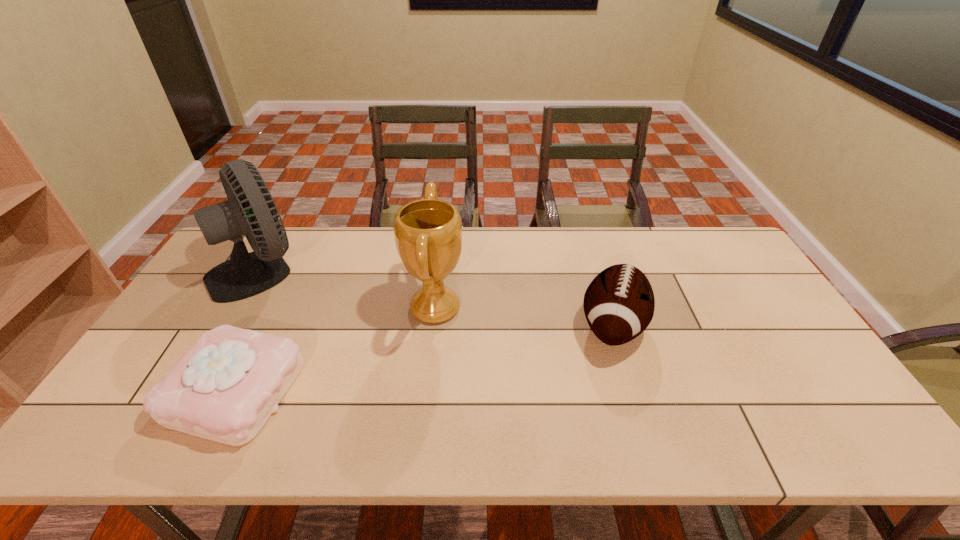
At what (x,y) coordinates should I click in order to perform the action: click on object that is at the near edge. Please return your answer as a coordinate pair (x, y). Looking at the image, I should click on (224, 388).

Image resolution: width=960 pixels, height=540 pixels. I want to click on fan situated at the left edge, so click(250, 210).

Identify the location of cake located at the left edge. Image resolution: width=960 pixels, height=540 pixels. (224, 388).

Identify the location of object that is at the far left corner. (x=250, y=210).

Where is `object that is at the near left corner`? The width and height of the screenshot is (960, 540). object that is at the near left corner is located at coordinates (224, 388).

Where is `vacant space at the far edge of the desktop`? The image size is (960, 540). vacant space at the far edge of the desktop is located at coordinates (515, 250).

This screenshot has height=540, width=960. What are the coordinates of `blank space at the near edge of the desktop` in the screenshot? It's located at (183, 436).

The width and height of the screenshot is (960, 540). I want to click on free space at the left edge, so click(183, 314).

Find the location of a particular element. vacant space at the right edge of the desktop is located at coordinates (810, 399).

In the image, there is a desktop. At what (x,y) coordinates should I click in order to perform the action: click on vacant space at the near left corner. Please return your answer as a coordinate pair (x, y). The width and height of the screenshot is (960, 540). Looking at the image, I should click on (84, 451).